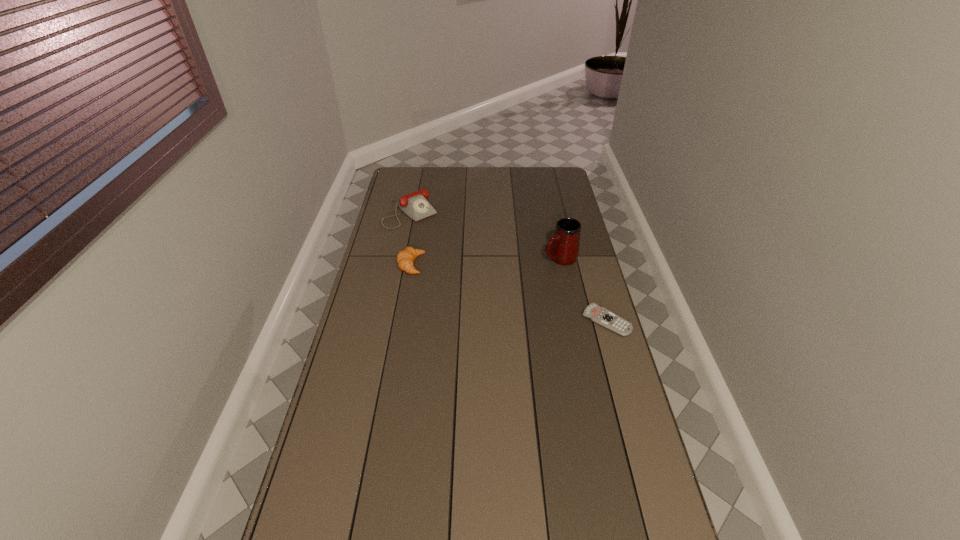
The width and height of the screenshot is (960, 540). In order to click on the second shortest object in this screenshot , I will do `click(405, 258)`.

Find the location of `remote control`. remote control is located at coordinates (599, 315).

Locate an element on the screen. This screenshot has width=960, height=540. the nearest object is located at coordinates click(x=599, y=315).

This screenshot has height=540, width=960. Identify the location of the tallest object. (563, 248).

Locate an element on the screen. This screenshot has width=960, height=540. telephone is located at coordinates (415, 205).

Locate an element on the screen. the farthest object is located at coordinates (415, 205).

The height and width of the screenshot is (540, 960). What are the coordinates of `vacant region located 0.280m on the front of the crescent roll` in the screenshot? It's located at 399,330.

Identify the location of free space located 0.350m on the back of the shortest object. This screenshot has width=960, height=540. (586, 247).

The height and width of the screenshot is (540, 960). In order to click on vacant space positioned 0.270m on the side of the mug with the handle in this screenshot , I will do `click(490, 284)`.

In order to click on vacant area situated 0.260m on the side of the mug with the handle in this screenshot , I will do `click(492, 283)`.